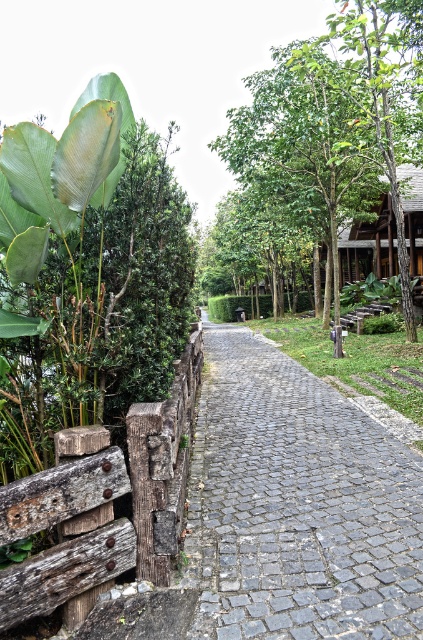
Question: Does gray cobblestone pavement at center come in front of wooden hut at right?

Choices:
 (A) no
 (B) yes

Answer: (B)

Question: Which point is farther from the camera taking this photo?

Choices:
 (A) (387, 220)
 (B) (373, 308)
 (C) (395, 163)
 (D) (202, 500)

Answer: (A)

Question: Does wooden hut at right have a lesser width compared to wooden park bench at center?

Choices:
 (A) no
 (B) yes

Answer: (A)

Question: From the image, what is the correct spatial relationship of gray cobblestone pavement at center in relation to green leafy tree at upper center?

Choices:
 (A) right
 (B) left

Answer: (B)

Question: Which object is positioned closest to the gray cobblestone pavement at center?

Choices:
 (A) green leafy tree at upper center
 (B) wooden hut at right

Answer: (A)

Question: Which point is closer to the camera?

Choices:
 (A) (381, 305)
 (B) (362, 234)
 (C) (365, 442)

Answer: (C)